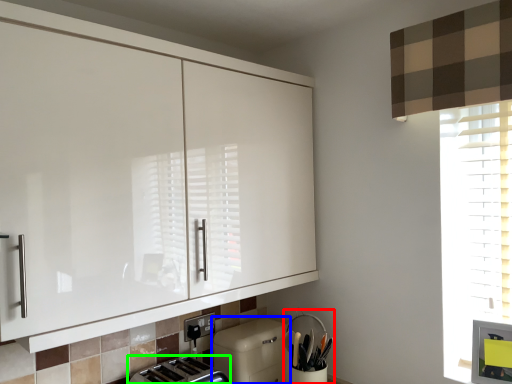
Question: Which is farther away from appliance (highlighted by a red box)? dish washer (highlighted by a blue box) or toaster (highlighted by a green box)?

Choices:
 (A) dish washer
 (B) toaster

Answer: (B)